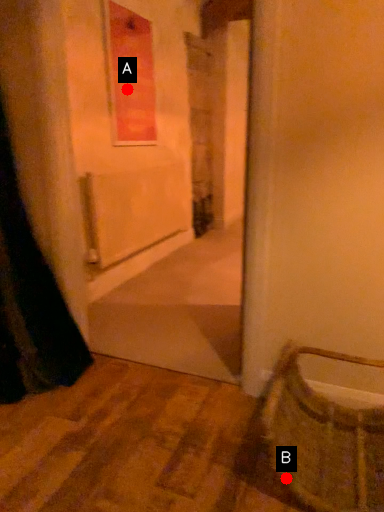
Question: Two points are circled on the image, labeled by A and B beside each circle. Which point appears farthest from the camera in this image?

Choices:
 (A) A is further
 (B) B is further

Answer: (A)